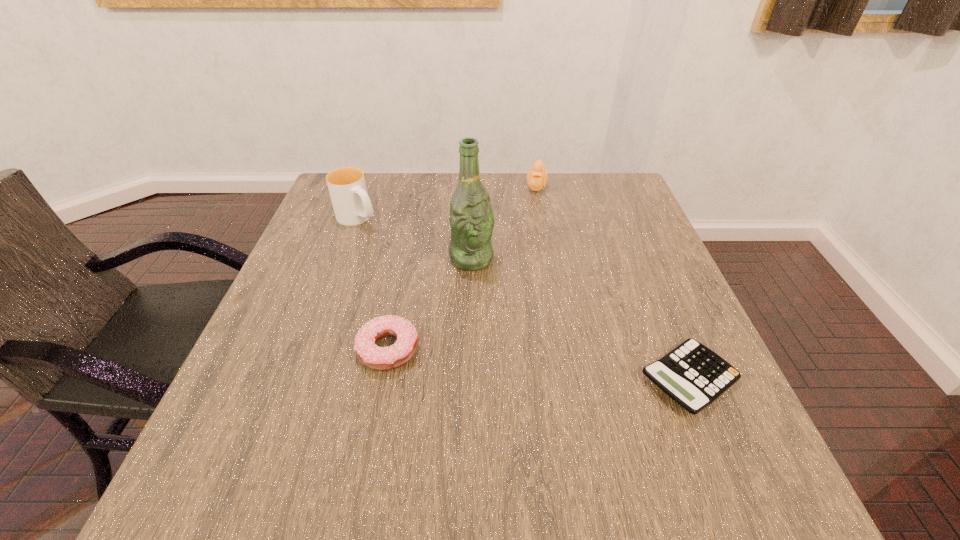
Select which object appears as the second closest to the farthest object. Please provide its 2D coordinates. Your answer should be formatted as a tuple, i.e. [(x, y)], where the tuple contains the x and y coordinates of a point satisfying the conditions above.

[(352, 206)]

Choose which object is the third nearest neighbor to the second object from left to right. Please provide its 2D coordinates. Your answer should be formatted as a tuple, i.e. [(x, y)], where the tuple contains the x and y coordinates of a point satisfying the conditions above.

[(694, 376)]

Where is `free location that satisfies the following two spatial constraints: 1. on the front side of the second object from left to right; 2. on the right side of the cup`? free location that satisfies the following two spatial constraints: 1. on the front side of the second object from left to right; 2. on the right side of the cup is located at coordinates (310, 349).

This screenshot has height=540, width=960. I want to click on free point that satisfies the following two spatial constraints: 1. on the back side of the second shortest object; 2. on the left side of the duckling, so click(420, 186).